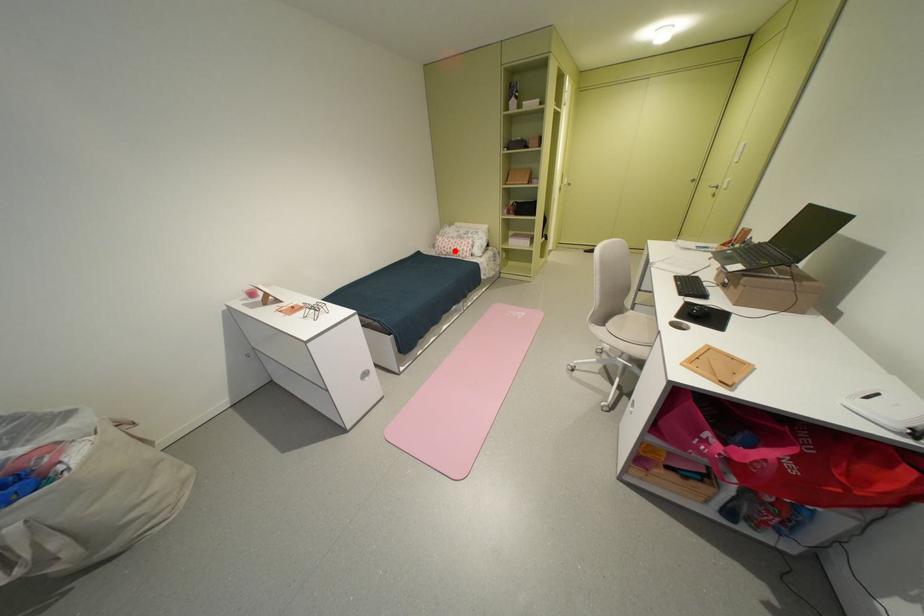
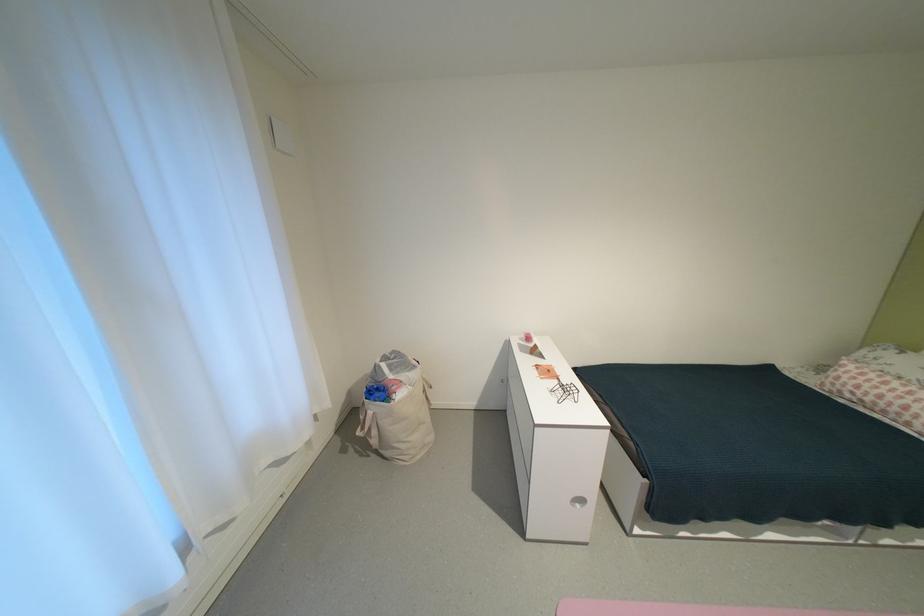
Question: I am providing you with two images of the same scene from different viewpoints. In image1, a red point is highlighted. Considering the same 3D point in image2, which of the following is correct?

Choices:
 (A) It is closer
 (B) It is farther

Answer: (B)